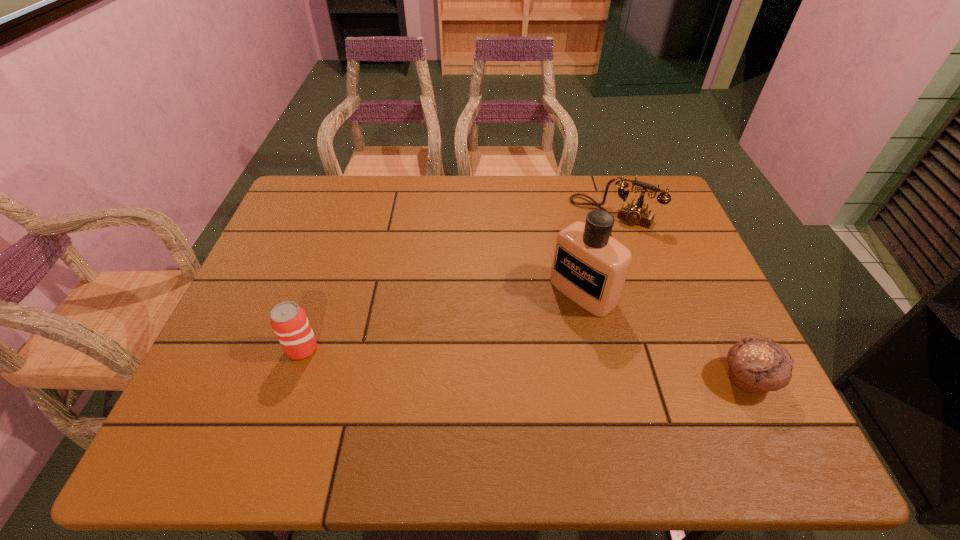
Find the location of a particular element. The width and height of the screenshot is (960, 540). blank area at the near edge is located at coordinates (279, 380).

Where is `vacant space at the left edge of the desktop`? This screenshot has width=960, height=540. vacant space at the left edge of the desktop is located at coordinates (217, 355).

At what (x,y) coordinates should I click in order to perform the action: click on free space at the right edge. Please return your answer as a coordinate pair (x, y). The width and height of the screenshot is (960, 540). Looking at the image, I should click on pos(655,256).

Identify the location of vacant space at the far left corner of the desktop. The height and width of the screenshot is (540, 960). (323, 214).

What are the coordinates of `free region at the far right corner of the desktop` in the screenshot? It's located at (616, 194).

Locate an element on the screen. The height and width of the screenshot is (540, 960). free space at the near right corner of the desktop is located at coordinates (720, 381).

Locate an element on the screen. empty location between the farthest object and the shortest object is located at coordinates [681, 296].

You are a GUI agent. You are given a task and a screenshot of the screen. Output one action in this format:
    pyautogui.click(x=<x>, y=<y>)
    Task: Click on the vacant space that's between the muffin and the leftmost object
    
    Given the screenshot: What is the action you would take?
    pyautogui.click(x=525, y=364)

Locate an element on the screen. The width and height of the screenshot is (960, 540). free space between the shortest object and the beer can is located at coordinates (525, 364).

I want to click on free space between the telephone and the leftmost object, so click(x=458, y=280).